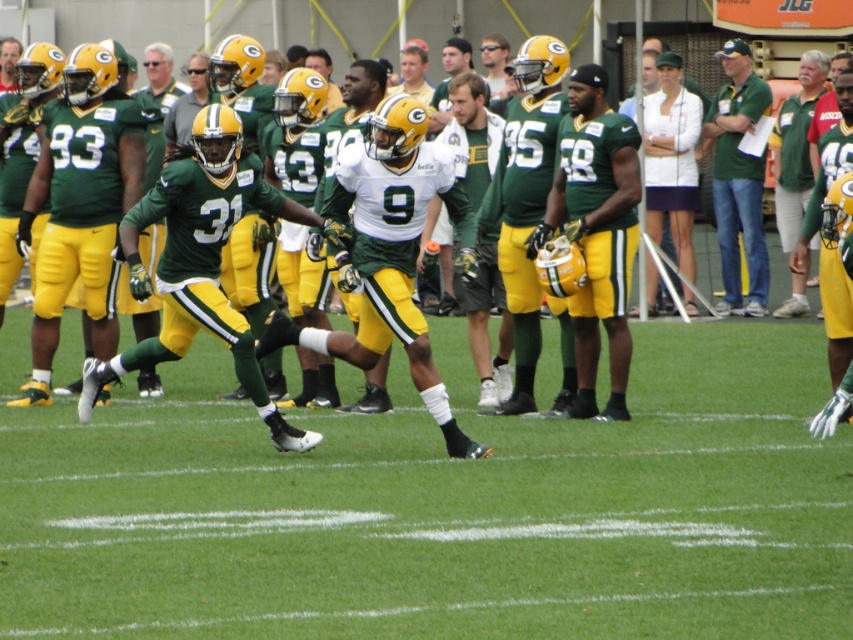
Question: Among these objects, which one is nearest to the camera?

Choices:
 (A) green grass football field at center
 (B) matte green jersey at center
 (C) matte green helmet at center
 (D) matte green helmet at upper center

Answer: (A)

Question: Which point is closer to the camera taking this photo?

Choices:
 (A) (50, 513)
 (B) (491, 76)
 (C) (763, 163)
 (D) (805, 152)

Answer: (A)

Question: Is matte green uniform at center to the left of matte green helmet at center from the viewer's perspective?

Choices:
 (A) no
 (B) yes

Answer: (A)

Question: Can you confirm if green matte jersey at upper right is bigger than smooth white shirt at upper center?

Choices:
 (A) yes
 (B) no

Answer: (A)

Question: Which is farther from the smooth white shirt at upper center?

Choices:
 (A) green matte jersey at upper right
 (B) green matte shirt at upper right
 (C) green grass football field at center

Answer: (C)

Question: Does green grass football field at center appear over smooth white shirt at upper center?

Choices:
 (A) yes
 (B) no

Answer: (B)